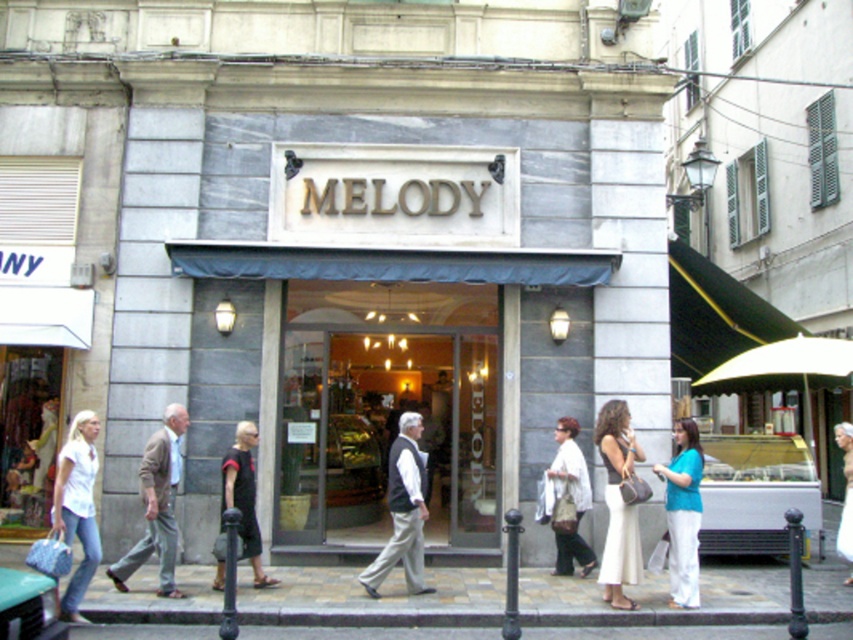
You are a tailor observing the people on the street in front of the shop named MELODY. You notice two garments of interest. The first is the gray wool vest at center, and the second is the teal fabric blouse at lower right. Which garment appears taller in the image?

The gray wool vest at center appears taller than the teal fabric blouse at lower right in the image.

From the picture: You are a tailor observing the street scene in front of the shop named MELODY. You notice the white cotton pants at center and the teal fabric blouse at lower right. Which clothing item has a greater width?

The white cotton pants at center has a greater width than the teal fabric blouse at lower right.